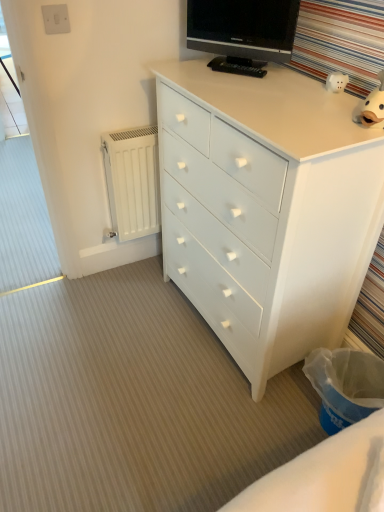
Question: In terms of width, does white plastic switch at upper left look wider or thinner when compared to white glossy piggy bank at upper right?

Choices:
 (A) wide
 (B) thin

Answer: (B)

Question: Looking at the image, does white plastic switch at upper left seem bigger or smaller compared to white glossy piggy bank at upper right?

Choices:
 (A) small
 (B) big

Answer: (A)

Question: Which of these objects is positioned farthest from the transparent plastic screen door at upper left?

Choices:
 (A) white plastic switch at upper left
 (B) white painted wood chest of drawers at center
 (C) white glossy piggy bank at upper right
 (D) white matte radiator at lower left
 (E) black glossy tv at upper center

Answer: (C)

Question: Which of these objects is positioned farthest from the white matte radiator at lower left?

Choices:
 (A) white plastic switch at upper left
 (B) white painted wood chest of drawers at center
 (C) white glossy piggy bank at upper right
 (D) transparent plastic screen door at upper left
 (E) black glossy tv at upper center

Answer: (D)